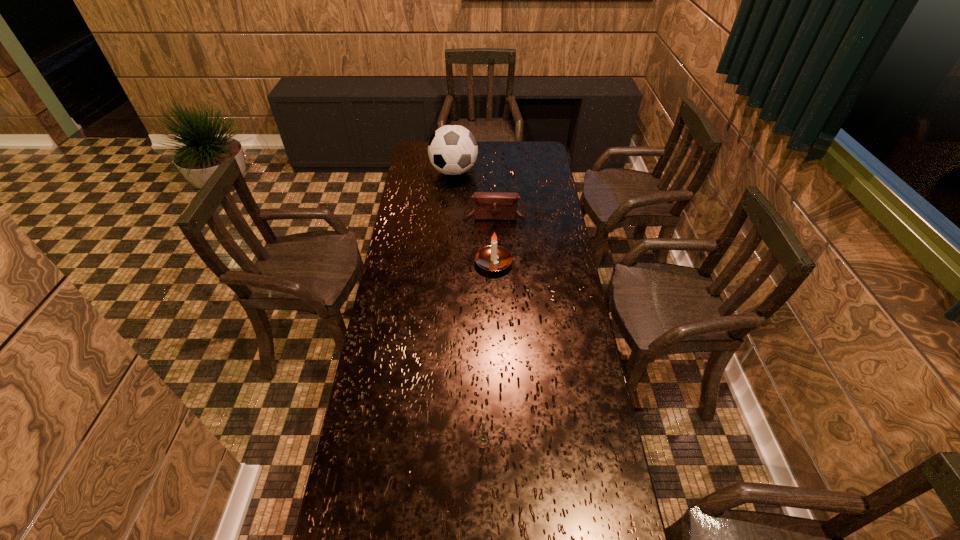
At what (x,y) coordinates should I click in order to perform the action: click on the farthest object. Please return your answer as a coordinate pair (x, y). Looking at the image, I should click on (452, 149).

You are a GUI agent. You are given a task and a screenshot of the screen. Output one action in this format:
    pyautogui.click(x=<x>, y=<y>)
    Task: Click on the tallest object
    
    Given the screenshot: What is the action you would take?
    pyautogui.click(x=452, y=149)

The width and height of the screenshot is (960, 540). I want to click on the taller candle, so click(493, 258).

The image size is (960, 540). Identify the location of the second tallest object. tap(493, 258).

Locate an element on the screen. This screenshot has height=540, width=960. shoulder bag is located at coordinates (487, 205).

You are a GUI agent. You are given a task and a screenshot of the screen. Output one action in this format:
    pyautogui.click(x=<x>, y=<y>)
    Task: Click on the nearest object
    
    Given the screenshot: What is the action you would take?
    pyautogui.click(x=483, y=441)

Locate an element on the screen. the nearer candle is located at coordinates (483, 441).

The height and width of the screenshot is (540, 960). I want to click on free space located 0.300m on the main logo of the soccer ball, so click(x=450, y=224).

Find the location of a particular element. free space located 0.360m on the left of the farther candle is located at coordinates (388, 263).

This screenshot has width=960, height=540. What are the coordinates of `free spot located on the front flap of the third nearest object` in the screenshot? It's located at 496,236.